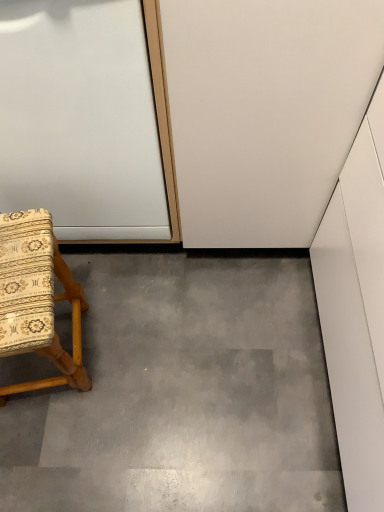
Question: Is gray concrete at lower left to the right of white glossy door at upper left from the viewer's perspective?

Choices:
 (A) yes
 (B) no

Answer: (A)

Question: Is gray concrete at lower left taller than white glossy door at upper left?

Choices:
 (A) no
 (B) yes

Answer: (A)

Question: Would you say gray concrete at lower left is a long distance from white glossy door at upper left?

Choices:
 (A) yes
 (B) no

Answer: (B)

Question: Considering the relative sizes of gray concrete at lower left and white glossy door at upper left in the image provided, is gray concrete at lower left thinner than white glossy door at upper left?

Choices:
 (A) no
 (B) yes

Answer: (A)

Question: Is gray concrete at lower left not within white glossy door at upper left?

Choices:
 (A) no
 (B) yes

Answer: (B)

Question: Is white glossy door at upper left surrounded by gray concrete at lower left?

Choices:
 (A) yes
 (B) no

Answer: (B)

Question: Is wooden-patterned fabric chair at lower left located outside gray concrete at lower left?

Choices:
 (A) yes
 (B) no

Answer: (A)

Question: Is wooden-patterned fabric chair at lower left at the left side of gray concrete at lower left?

Choices:
 (A) yes
 (B) no

Answer: (A)

Question: From a real-world perspective, is wooden-patterned fabric chair at lower left over gray concrete at lower left?

Choices:
 (A) no
 (B) yes

Answer: (B)

Question: Is wooden-patterned fabric chair at lower left further to the viewer compared to gray concrete at lower left?

Choices:
 (A) yes
 (B) no

Answer: (B)

Question: From a real-world perspective, is wooden-patterned fabric chair at lower left located beneath gray concrete at lower left?

Choices:
 (A) yes
 (B) no

Answer: (B)

Question: Can you confirm if wooden-patterned fabric chair at lower left is wider than gray concrete at lower left?

Choices:
 (A) yes
 (B) no

Answer: (B)

Question: From the image's perspective, would you say white glossy door at upper left is shown under wooden-patterned fabric chair at lower left?

Choices:
 (A) yes
 (B) no

Answer: (B)